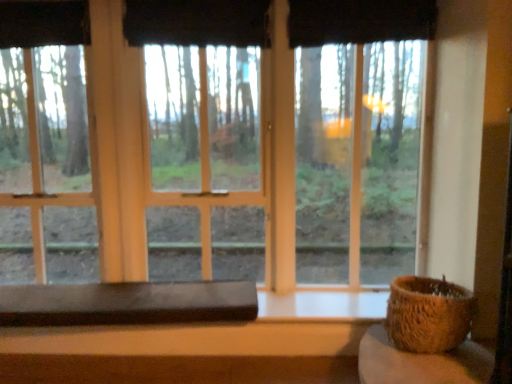
I want to click on free spot above white matte window sill at lower center (from a real-world perspective), so click(325, 297).